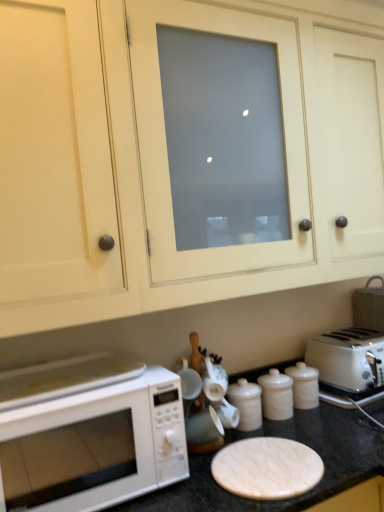
Question: Does white matte microwave at lower left have a lesser width compared to white glossy canister at center?

Choices:
 (A) yes
 (B) no

Answer: (B)

Question: Can you confirm if white matte microwave at lower left is smaller than white glossy canister at center?

Choices:
 (A) yes
 (B) no

Answer: (B)

Question: From a real-world perspective, is white matte microwave at lower left positioned under white glossy canister at center based on gravity?

Choices:
 (A) yes
 (B) no

Answer: (B)

Question: Could white glossy canister at center be considered to be inside white matte microwave at lower left?

Choices:
 (A) yes
 (B) no

Answer: (B)

Question: Considering the relative positions of white matte microwave at lower left and white glossy canister at center in the image provided, is white matte microwave at lower left to the left of white glossy canister at center from the viewer's perspective?

Choices:
 (A) yes
 (B) no

Answer: (A)

Question: Considering the positions of point (69, 399) and point (259, 417), is point (69, 399) closer or farther from the camera than point (259, 417)?

Choices:
 (A) closer
 (B) farther

Answer: (A)

Question: Would you say white matte microwave at lower left is inside or outside white glossy canister at center?

Choices:
 (A) inside
 (B) outside

Answer: (B)

Question: Is white matte microwave at lower left bigger or smaller than white glossy canister at center?

Choices:
 (A) big
 (B) small

Answer: (A)

Question: Looking at their shapes, would you say white matte microwave at lower left is wider or thinner than white glossy canister at center?

Choices:
 (A) wide
 (B) thin

Answer: (A)

Question: Considering the positions of white glossy canister at center and white marble counter top at lower center in the image, is white glossy canister at center taller or shorter than white marble counter top at lower center?

Choices:
 (A) short
 (B) tall

Answer: (A)

Question: From a real-world perspective, is white glossy canister at center physically located above or below white marble counter top at lower center?

Choices:
 (A) below
 (B) above

Answer: (B)

Question: Would you say white glossy canister at center is inside or outside white marble counter top at lower center?

Choices:
 (A) outside
 (B) inside

Answer: (B)

Question: Is white glossy canister at center to the left or to the right of white marble counter top at lower center in the image?

Choices:
 (A) left
 (B) right

Answer: (B)

Question: From a real-world perspective, relative to white marble counter top at lower center, is white plastic toaster at right vertically above or below?

Choices:
 (A) below
 (B) above

Answer: (B)

Question: Considering the positions of point (316, 340) and point (329, 450), is point (316, 340) closer or farther from the camera than point (329, 450)?

Choices:
 (A) closer
 (B) farther

Answer: (A)